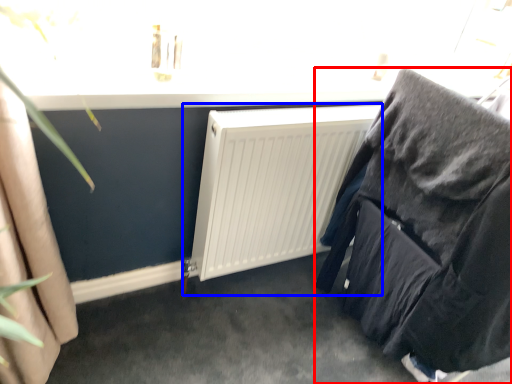
Question: Which object is closer to the camera taking this photo, furniture (highlighted by a red box) or radiator (highlighted by a blue box)?

Choices:
 (A) furniture
 (B) radiator

Answer: (A)